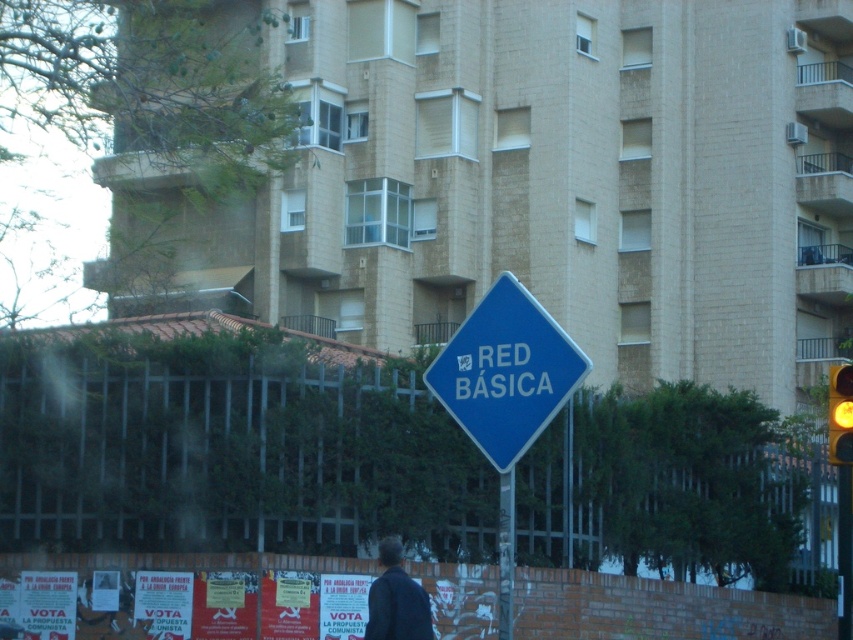
You are a pedestrian standing on the sidewalk in front of the residential building. You see the blue plastic sign at center and the yellow glass traffic light at right. Which object is located higher up in the scene?

The blue plastic sign at center is positioned over the yellow glass traffic light at right, so it is located higher up in the scene.